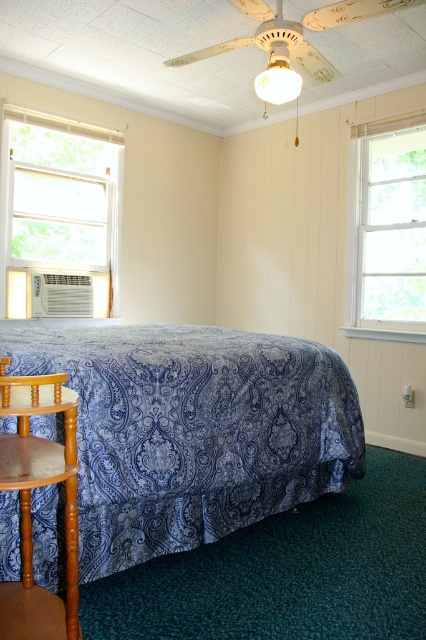
Question: Is blue paisley fabric bedspread at center thinner than white fabric window at left?

Choices:
 (A) no
 (B) yes

Answer: (A)

Question: Which object is positioned closest to the matte white bulb at upper center?

Choices:
 (A) white wood window at right
 (B) wooden armchair at lower left
 (C) white fabric window at left

Answer: (A)

Question: Can you confirm if blue paisley fabric bedspread at center is smaller than matte white bulb at upper center?

Choices:
 (A) yes
 (B) no

Answer: (B)

Question: Which point is closer to the camera taking this photo?

Choices:
 (A) (285, 86)
 (B) (161, 532)
 (C) (37, 212)

Answer: (B)

Question: Does wooden armchair at lower left appear on the right side of matte white bulb at upper center?

Choices:
 (A) no
 (B) yes

Answer: (A)

Question: Which object is the farthest from the matte white bulb at upper center?

Choices:
 (A) wooden armchair at lower left
 (B) white fabric window at left
 (C) white wood window at right

Answer: (A)